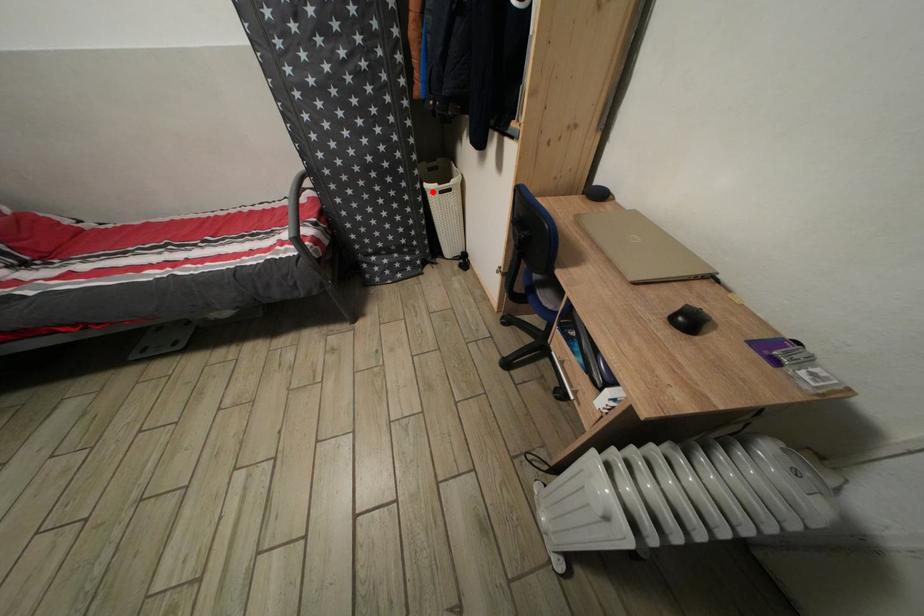
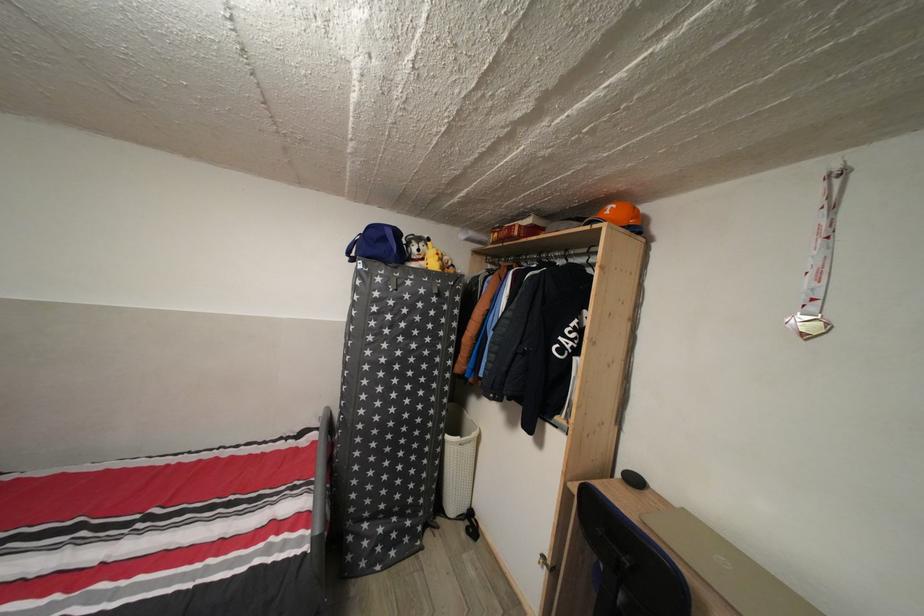
Question: I am providing you with two images of the same scene from different viewpoints. Image1 has a red point marked. In image2, the corresponding 3D location appears at what relative position? Reply with the corresponding letter.

Choices:
 (A) Closer
 (B) Farther

Answer: (B)